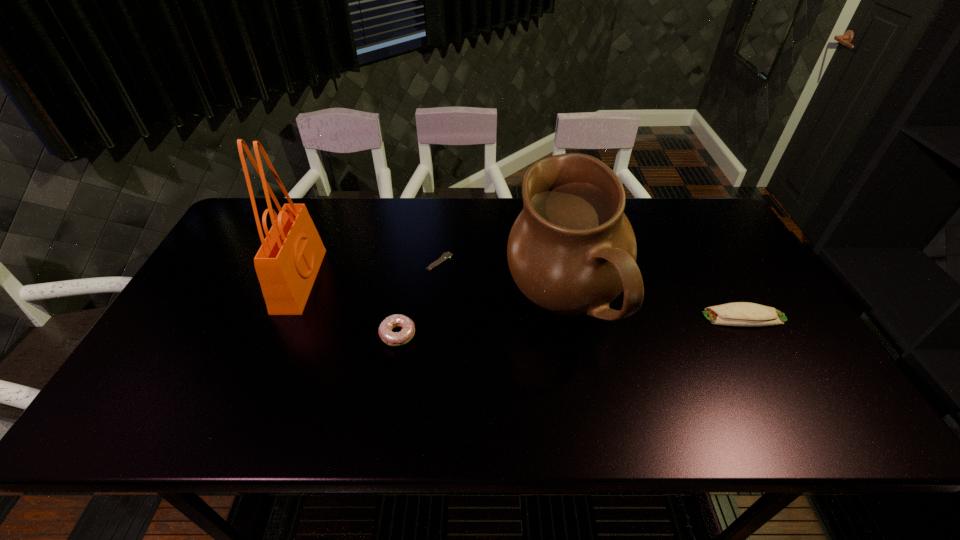
Where is `free location located at the spout of the fourth object from left to right`? The height and width of the screenshot is (540, 960). free location located at the spout of the fourth object from left to right is located at coordinates (413, 306).

The image size is (960, 540). I want to click on blank space located at the spout of the fourth object from left to right, so click(x=397, y=306).

You are a GUI agent. You are given a task and a screenshot of the screen. Output one action in this format:
    pyautogui.click(x=<x>, y=<y>)
    Task: Click on the free space located 0.140m at the spout of the fourth object from left to right
    
    Given the screenshot: What is the action you would take?
    click(x=453, y=306)

This screenshot has width=960, height=540. Find the location of `free space located 0.100m on the back of the doughnut`. free space located 0.100m on the back of the doughnut is located at coordinates (405, 293).

Image resolution: width=960 pixels, height=540 pixels. What are the coordinates of `free space located 0.220m at the bitten end of the rightmost object` in the screenshot? It's located at (619, 317).

Where is `blank space located 0.220m at the bitten end of the rightmost object`? blank space located 0.220m at the bitten end of the rightmost object is located at coordinates (619, 317).

Where is `free point located 0.320m at the bitten end of the rightmost object`? free point located 0.320m at the bitten end of the rightmost object is located at coordinates (581, 317).

Identify the location of vacant space positioned 0.280m on the right of the third object from left to right. pos(546,262).

Find the location of a particular element. object present at the right edge is located at coordinates (738, 313).

The width and height of the screenshot is (960, 540). In the image, there is a desktop. In order to click on vacant space at the far edge in this screenshot , I will do 490,214.